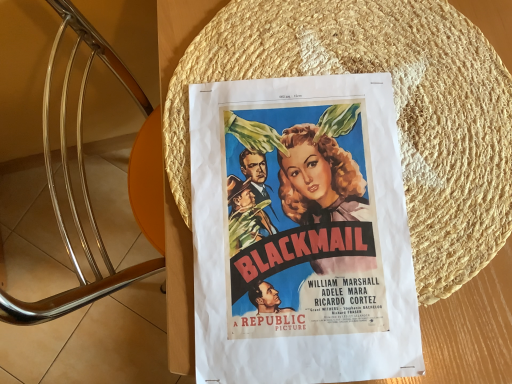
This screenshot has width=512, height=384. What do you see at coordinates (396, 106) in the screenshot?
I see `woven straw hat at center` at bounding box center [396, 106].

Measure the distance between woven straw hat at center and camera.

woven straw hat at center is 15.83 inches away from camera.

In order to click on woven straw hat at center in this screenshot , I will do pyautogui.click(x=396, y=106).

Where is `matte paper poster at center`? The image size is (512, 384). matte paper poster at center is located at coordinates (301, 232).

What do you see at coordinates (301, 232) in the screenshot? I see `matte paper poster at center` at bounding box center [301, 232].

At what (x,y) coordinates should I click in order to perform the action: click on woven straw hat at center. Please return your answer as a coordinate pair (x, y). Looking at the image, I should click on (396, 106).

Looking at this image, can you confirm if matte paper poster at center is positioned to the left of woven straw hat at center?

Indeed, matte paper poster at center is positioned on the left side of woven straw hat at center.

Is the position of matte paper poster at center less distant than that of woven straw hat at center?

Yes, it is in front of woven straw hat at center.

Which is closer to the camera, [339,203] or [318,26]?

Positioned in front is point [339,203].

From the image's perspective, who appears lower, matte paper poster at center or woven straw hat at center?

matte paper poster at center is shown below in the image.

From a real-world perspective, which is physically above, matte paper poster at center or woven straw hat at center?

From a 3D spatial view, matte paper poster at center is above.

Between matte paper poster at center and woven straw hat at center, which one has smaller width?

Thinner between the two is matte paper poster at center.

Which of these two, matte paper poster at center or woven straw hat at center, stands shorter?

woven straw hat at center.

Does matte paper poster at center have a larger size compared to woven straw hat at center?

Incorrect, matte paper poster at center is not larger than woven straw hat at center.

Is woven straw hat at center located within matte paper poster at center?

Yes.

Is the surface of matte paper poster at center in direct contact with woven straw hat at center?

Yes, the surface of matte paper poster at center is in contact with woven straw hat at center.

Is matte paper poster at center aimed at woven straw hat at center?

Yes, matte paper poster at center faces towards woven straw hat at center.

This screenshot has height=384, width=512. I want to click on straw hat on the right of matte paper poster at center, so click(x=396, y=106).

Can you confirm if woven straw hat at center is positioned to the left of matte paper poster at center?

In fact, woven straw hat at center is to the right of matte paper poster at center.

Which object is closer to the camera, woven straw hat at center or matte paper poster at center?

matte paper poster at center is more forward.

Which is behind, point (181, 187) or point (309, 196)?

The point (181, 187) is farther from the camera.

From the image's perspective, which is above, woven straw hat at center or matte paper poster at center?

From the image's view, woven straw hat at center is above.

From a real-world perspective, is woven straw hat at center located beneath matte paper poster at center?

Yes, from a real-world perspective, woven straw hat at center is under matte paper poster at center.

Looking at their sizes, would you say woven straw hat at center is wider or thinner than matte paper poster at center?

In the image, woven straw hat at center appears to be wider than matte paper poster at center.

Which of these two, woven straw hat at center or matte paper poster at center, stands taller?

matte paper poster at center is taller.

Between woven straw hat at center and matte paper poster at center, which one has smaller size?

matte paper poster at center is smaller.

Can we say woven straw hat at center lies outside matte paper poster at center?

No.

Looking at this image, is woven straw hat at center not near matte paper poster at center?

No, there isn't a large distance between woven straw hat at center and matte paper poster at center.

Is woven straw hat at center facing away from matte paper poster at center?

Yes, matte paper poster at center is at the back of woven straw hat at center.

What's the angular difference between woven straw hat at center and matte paper poster at center's facing directions?

A: The angular difference between woven straw hat at center and matte paper poster at center is 7.66 degrees.

This screenshot has height=384, width=512. Find the location of `straw hat above the matte paper poster at center (from the image's perspective)`. straw hat above the matte paper poster at center (from the image's perspective) is located at coordinates click(x=396, y=106).

This screenshot has height=384, width=512. Find the location of `straw hat on the right of matte paper poster at center`. straw hat on the right of matte paper poster at center is located at coordinates (396, 106).

This screenshot has height=384, width=512. I want to click on poster in front of the woven straw hat at center, so click(301, 232).